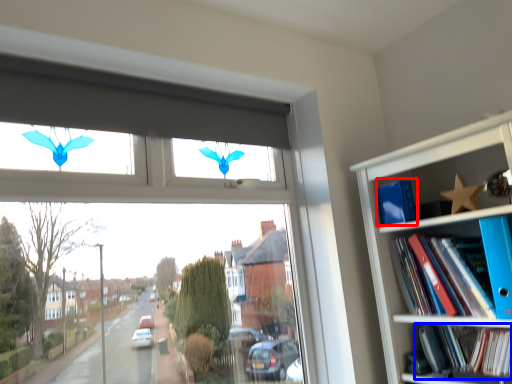
Question: Which object appears closest to the camera in this image, paperback book (highlighted by a red box) or book (highlighted by a blue box)?

Choices:
 (A) paperback book
 (B) book

Answer: (B)